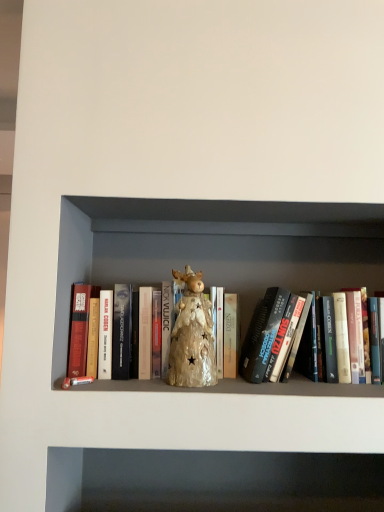
Question: Does matte gold statue at center appear on the left side of iridescent ceramic reindeer at center?

Choices:
 (A) yes
 (B) no

Answer: (B)

Question: Is iridescent ceramic reindeer at center located within matte gold statue at center?

Choices:
 (A) yes
 (B) no

Answer: (A)

Question: Is matte gold statue at center smaller than iridescent ceramic reindeer at center?

Choices:
 (A) no
 (B) yes

Answer: (A)

Question: From a real-world perspective, does matte gold statue at center stand above iridescent ceramic reindeer at center?

Choices:
 (A) no
 (B) yes

Answer: (B)

Question: Could you tell me if matte gold statue at center is turned towards iridescent ceramic reindeer at center?

Choices:
 (A) no
 (B) yes

Answer: (B)

Question: From the image's perspective, is matte gold statue at center under iridescent ceramic reindeer at center?

Choices:
 (A) yes
 (B) no

Answer: (A)

Question: Can you confirm if iridescent ceramic reindeer at center is taller than matte gold statue at center?

Choices:
 (A) no
 (B) yes

Answer: (A)

Question: Is iridescent ceramic reindeer at center shorter than matte gold statue at center?

Choices:
 (A) yes
 (B) no

Answer: (A)

Question: Is iridescent ceramic reindeer at center facing towards matte gold statue at center?

Choices:
 (A) yes
 (B) no

Answer: (A)

Question: Considering the relative sizes of iridescent ceramic reindeer at center and matte gold statue at center in the image provided, is iridescent ceramic reindeer at center thinner than matte gold statue at center?

Choices:
 (A) no
 (B) yes

Answer: (B)

Question: Are iridescent ceramic reindeer at center and matte gold statue at center beside each other?

Choices:
 (A) yes
 (B) no

Answer: (B)

Question: Can you confirm if iridescent ceramic reindeer at center is positioned to the right of matte gold statue at center?

Choices:
 (A) no
 (B) yes

Answer: (A)

Question: Considering the positions of iridescent ceramic reindeer at center and matte gold statue at center in the image, is iridescent ceramic reindeer at center wider or thinner than matte gold statue at center?

Choices:
 (A) wide
 (B) thin

Answer: (B)